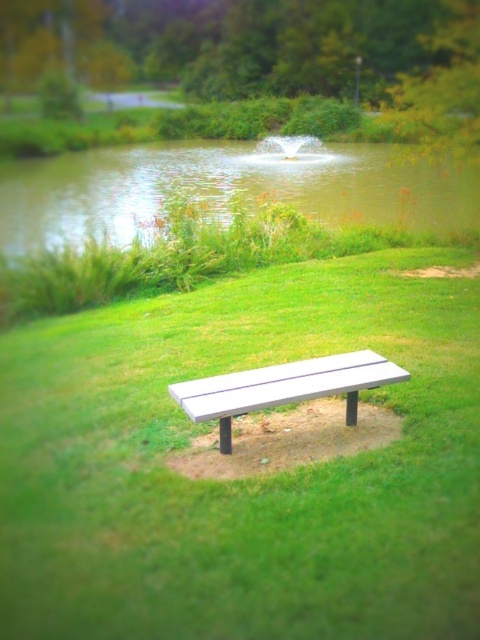
Question: Can you confirm if white wood bench at center is thinner than white plastic bench at center?

Choices:
 (A) no
 (B) yes

Answer: (B)

Question: Among these objects, which one is farthest from the camera?

Choices:
 (A) green leafy tree at center
 (B) white wood bench at center
 (C) green grass at lower center

Answer: (A)

Question: Which of the following is the farthest from the observer?

Choices:
 (A) white wood bench at center
 (B) green leafy tree at center
 (C) white plastic bench at center

Answer: (B)

Question: From the image, what is the correct spatial relationship of white wood bench at center in relation to green leafy tree at center?

Choices:
 (A) right
 (B) left

Answer: (A)

Question: Is green leafy tree at center behind white plastic bench at center?

Choices:
 (A) no
 (B) yes

Answer: (B)

Question: Which point is closer to the camera taking this photo?

Choices:
 (A) (324, 369)
 (B) (97, 410)
 (C) (468, 189)

Answer: (A)